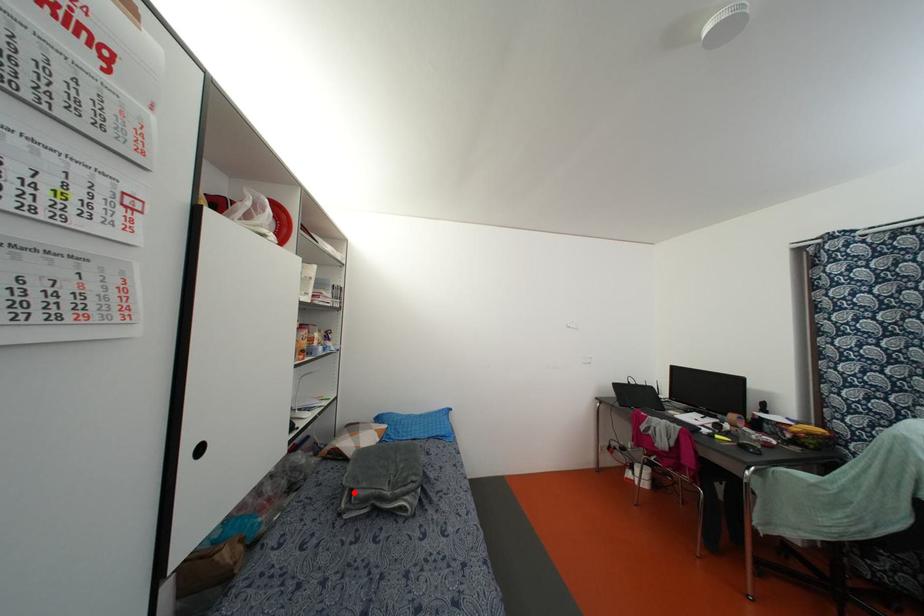
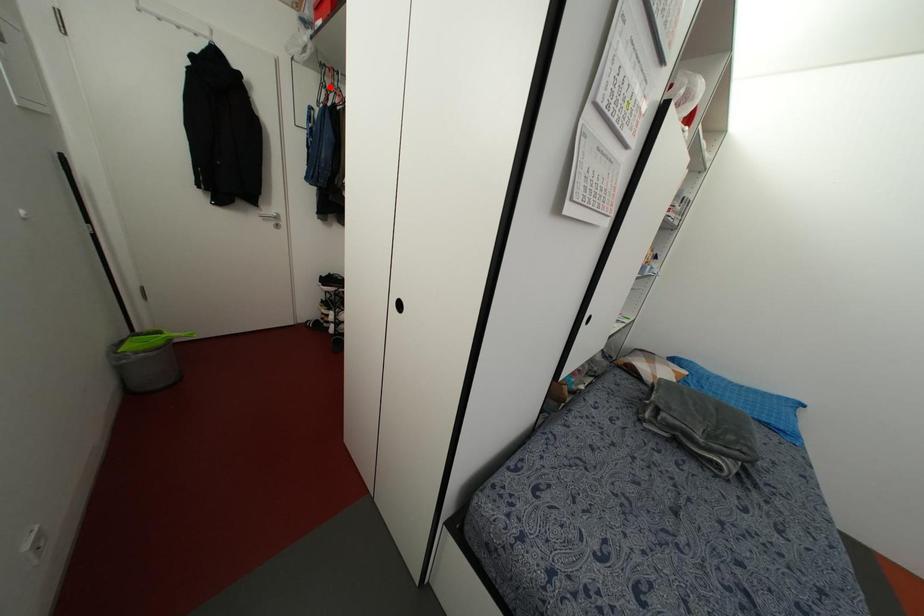
I am providing you with two images of the same scene from different viewpoints. A red point is marked on the first image and another point is marked on the second image. Is the red point in image1 aligned with the point shown in image2?

No